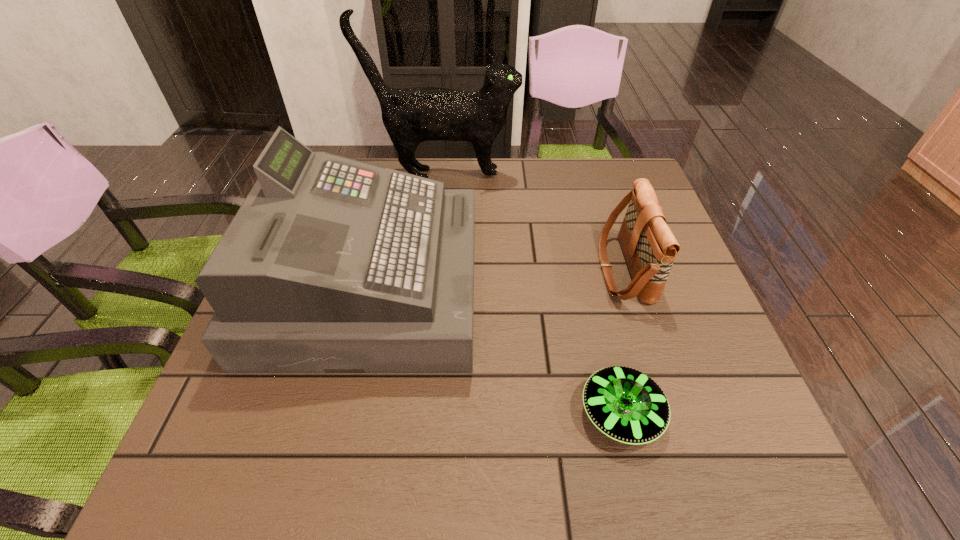
Image resolution: width=960 pixels, height=540 pixels. What are the coordinates of `vacant point located between the shortest object and the second shortest object` in the screenshot? It's located at (622, 341).

In order to click on unoccupied area between the shoulder bag and the cash register in this screenshot , I will do tap(496, 278).

At what (x,y) coordinates should I click in order to perform the action: click on the second closest object to the shoulder bag. Please return your answer as a coordinate pair (x, y). Looking at the image, I should click on (412, 115).

Identify which object is the third closest to the cat. Please provide its 2D coordinates. Your answer should be formatted as a tuple, i.e. [(x, y)], where the tuple contains the x and y coordinates of a point satisfying the conditions above.

[(625, 404)]

You are a GUI agent. You are given a task and a screenshot of the screen. Output one action in this format:
    pyautogui.click(x=<x>, y=<y>)
    Task: Click on the free location that satisfies the following two spatial constraints: 1. on the face of the shortest object; 2. on the right side of the farthest object
    The width and height of the screenshot is (960, 540).
    Given the screenshot: What is the action you would take?
    pyautogui.click(x=419, y=413)

At what (x,y) coordinates should I click in order to perform the action: click on free location that satisfies the following two spatial constraints: 1. on the front-facing side of the cash register; 2. on the back side of the nearest object. Please return your answer as a coordinate pair (x, y). Looking at the image, I should click on (339, 413).

In order to click on vacant point that satisfies the following two spatial constraints: 1. on the front-facing side of the cash register; 2. on the back side of the shortest object in this screenshot , I will do `click(339, 413)`.

This screenshot has height=540, width=960. In order to click on vacant region that satisfies the following two spatial constraints: 1. on the front-facing side of the second tallest object; 2. on the right side of the shortest object in this screenshot , I will do `click(339, 413)`.

Where is `vacant space that satisfies the following two spatial constraints: 1. on the front-facing side of the third shortest object; 2. on the back side of the nearest object`? Image resolution: width=960 pixels, height=540 pixels. vacant space that satisfies the following two spatial constraints: 1. on the front-facing side of the third shortest object; 2. on the back side of the nearest object is located at coordinates (339, 413).

At what (x,y) coordinates should I click in order to perform the action: click on vacant space that satisfies the following two spatial constraints: 1. on the front-facing side of the shoulder bag; 2. on the front side of the nearest object. Please return your answer as a coordinate pair (x, y). Looking at the image, I should click on (670, 413).